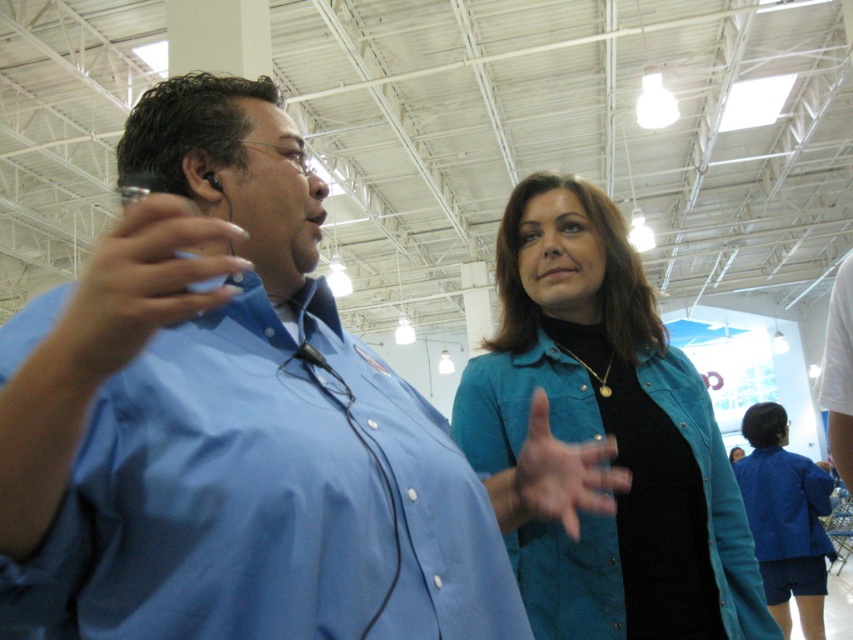
Question: Is teal denim shirt at center closer to camera compared to matte blue shirt at upper left?

Choices:
 (A) yes
 (B) no

Answer: (B)

Question: Which object is farther from the camera taking this photo?

Choices:
 (A) blue button-up shirt at center
 (B) teal denim shirt at center
 (C) matte blue shirt at upper left

Answer: (B)

Question: Which of the following is the closest to the observer?

Choices:
 (A) teal denim shirt at center
 (B) matte blue shirt at upper left
 (C) blue denim jacket at lower right
 (D) matte blue shirt at center

Answer: (B)

Question: Estimate the real-world distances between objects in this image. Which object is closer to the blue button-up shirt at center?

Choices:
 (A) matte blue shirt at center
 (B) blue denim jacket at lower right
 (C) matte blue shirt at upper left

Answer: (C)

Question: Is teal denim shirt at center positioned before matte blue shirt at upper left?

Choices:
 (A) yes
 (B) no

Answer: (B)

Question: Can you confirm if matte blue shirt at upper left is positioned to the left of blue denim jacket at lower right?

Choices:
 (A) no
 (B) yes

Answer: (B)